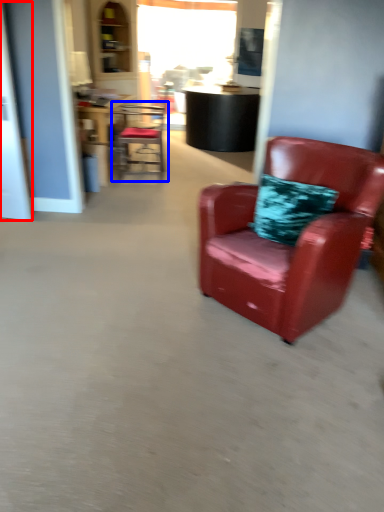
Question: Which object is closer to the camera taking this photo, glass door (highlighted by a red box) or chair (highlighted by a blue box)?

Choices:
 (A) glass door
 (B) chair

Answer: (A)